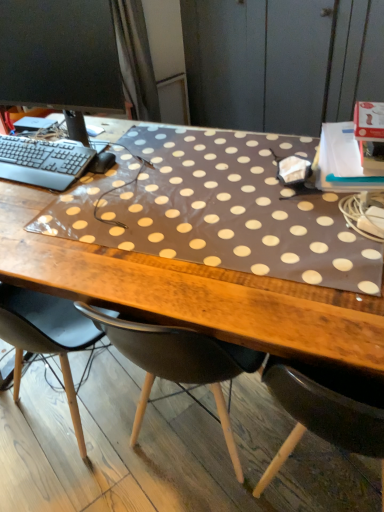
You are a GUI agent. You are given a task and a screenshot of the screen. Output one action in this format:
    pyautogui.click(x=<x>, y=<y>)
    Task: Click on the spots to the right of black glossy monitor at upper left
    The image size is (384, 512).
    Given the screenshot: What is the action you would take?
    pyautogui.click(x=160, y=146)